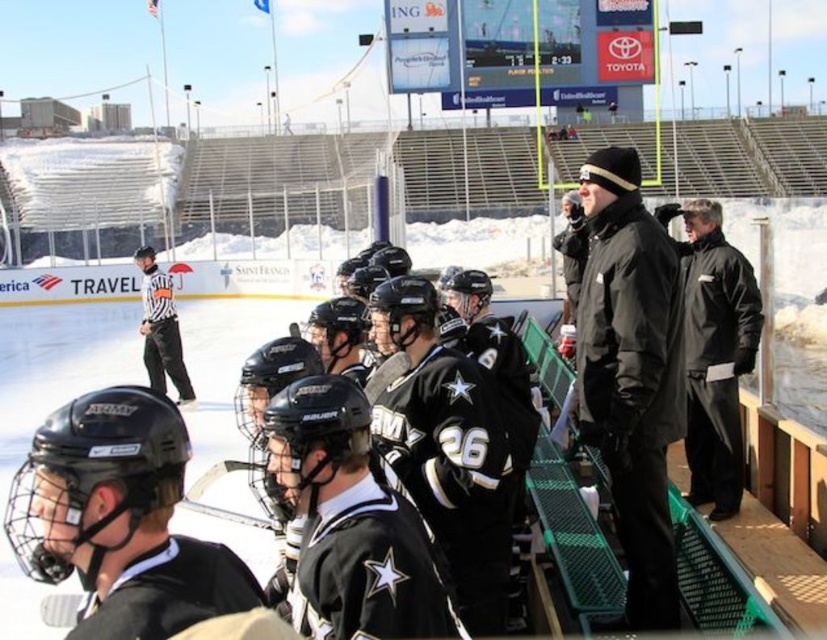
Question: Which object appears closest to the camera in this image?

Choices:
 (A) black matte hockey helmet at lower left
 (B) black mesh referee at center

Answer: (A)

Question: Among these objects, which one is nearest to the camera?

Choices:
 (A) black matte hockey helmets at center
 (B) black matte jacket at right
 (C) black matte hockey helmet at lower left
 (D) black matte jacket at upper right

Answer: (A)

Question: Considering the relative positions of black matte hockey helmets at center and black matte hockey helmet at lower left in the image provided, where is black matte hockey helmets at center located with respect to black matte hockey helmet at lower left?

Choices:
 (A) right
 (B) left

Answer: (B)

Question: Which point is closer to the camera?

Choices:
 (A) (720, 380)
 (B) (161, 339)

Answer: (A)

Question: Does black matte jacket at upper right appear on the left side of black mesh referee at center?

Choices:
 (A) yes
 (B) no

Answer: (B)

Question: Is black matte hockey helmets at center smaller than black mesh referee at center?

Choices:
 (A) no
 (B) yes

Answer: (A)